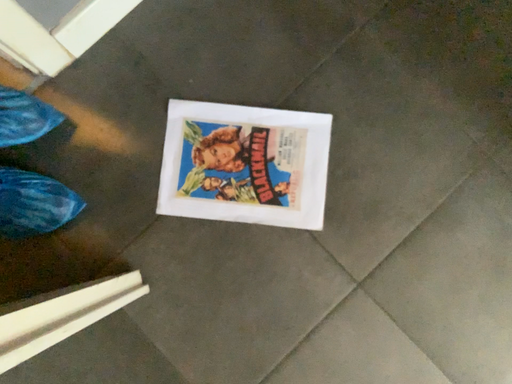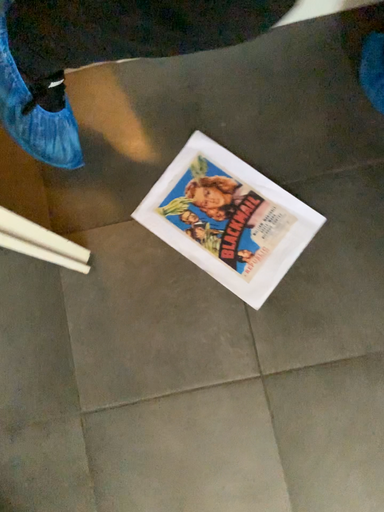
Question: How did the camera likely rotate when shooting the video?

Choices:
 (A) rotated left
 (B) rotated right

Answer: (A)